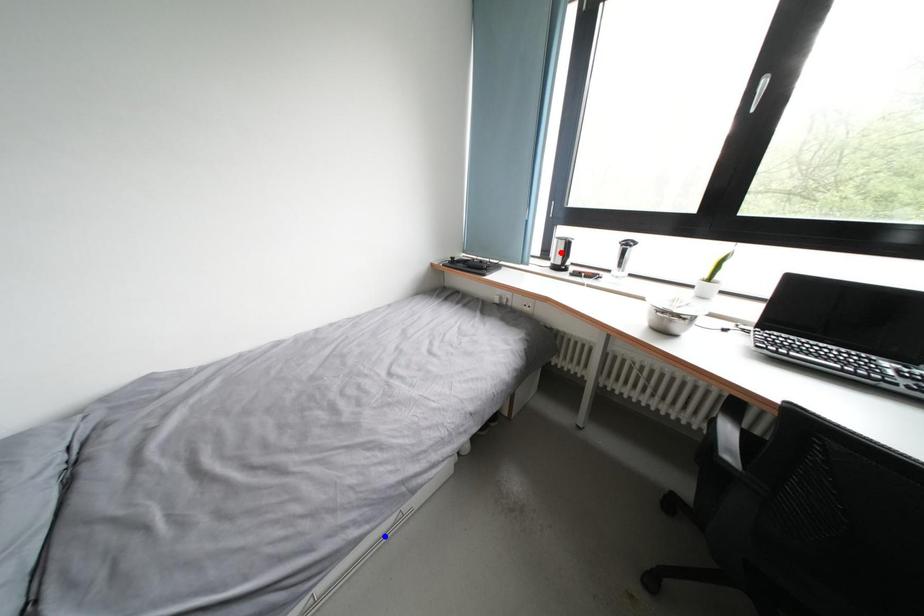
Question: Two points are marked on the image. Which point is closer to the camera?

Choices:
 (A) Blue point is closer.
 (B) Red point is closer.

Answer: (A)